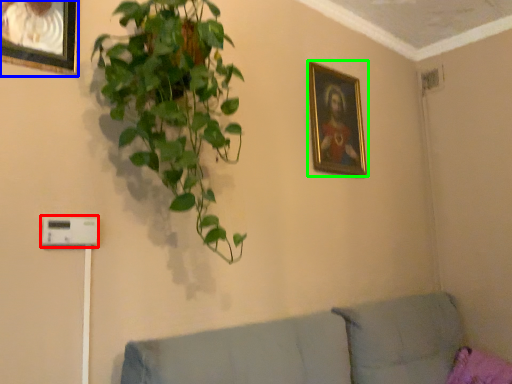
Question: Which object is the closest to the light switch (highlighted by a red box)? Choose among these: picture frame (highlighted by a blue box) or picture frame (highlighted by a green box).

Choices:
 (A) picture frame
 (B) picture frame

Answer: (A)